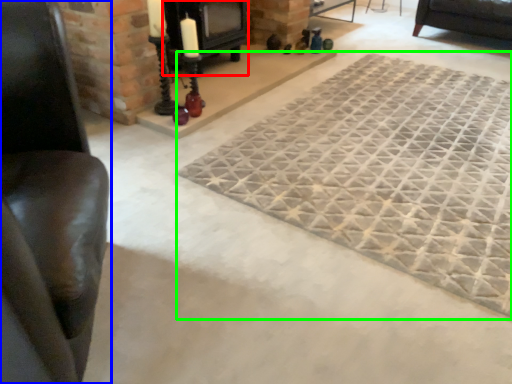
Question: Considering the real-world distances, which object is farthest from fireplace (highlighted by a red box)? furniture (highlighted by a blue box) or mat (highlighted by a green box)?

Choices:
 (A) furniture
 (B) mat

Answer: (A)